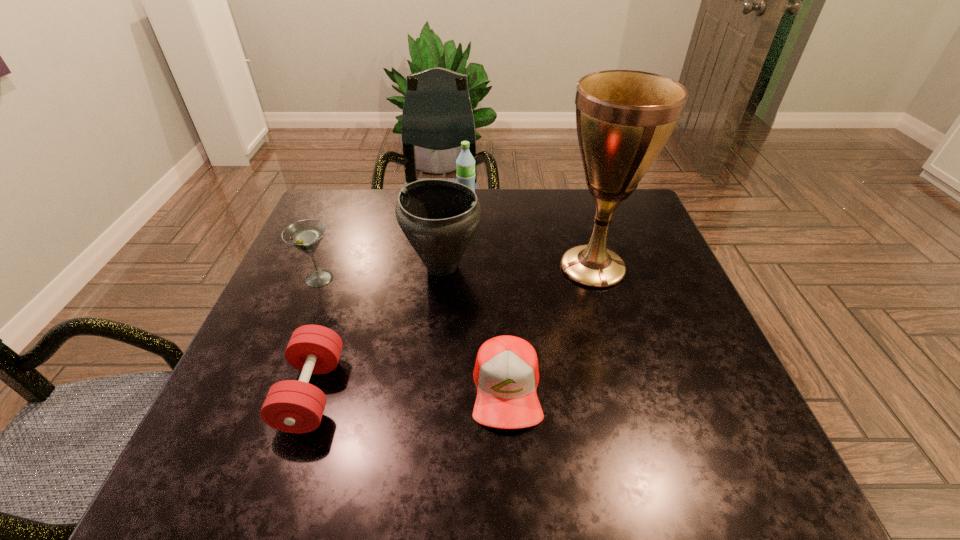
The height and width of the screenshot is (540, 960). I want to click on vacant space located 0.110m on the front of the third shortest object, so click(300, 329).

You are a GUI agent. You are given a task and a screenshot of the screen. Output one action in this format:
    pyautogui.click(x=<x>, y=<y>)
    Task: Click on the vacant space located on the back of the dumbbell
    This screenshot has height=540, width=960.
    Given the screenshot: What is the action you would take?
    pyautogui.click(x=348, y=281)

Find the location of a particular element. Image resolution: width=960 pixels, height=540 pixels. free location located 0.070m on the front-facing side of the shortest object is located at coordinates (511, 473).

You are a GUI agent. You are given a task and a screenshot of the screen. Output one action in this format:
    pyautogui.click(x=<x>, y=<y>)
    Task: Click on the object situated at the far edge
    The width and height of the screenshot is (960, 540).
    Given the screenshot: What is the action you would take?
    pyautogui.click(x=465, y=163)

The width and height of the screenshot is (960, 540). In order to click on object positioned at the near edge in this screenshot , I will do `click(291, 406)`.

Identify the location of martini that is at the left edge. (305, 235).

You are a GUI agent. You are given a task and a screenshot of the screen. Output one action in this format:
    pyautogui.click(x=<x>, y=<y>)
    Task: Click on the dumbbell at the left edge
    The image size is (960, 540).
    Given the screenshot: What is the action you would take?
    pyautogui.click(x=291, y=406)

Where is `object positioned at the right edge`? The image size is (960, 540). object positioned at the right edge is located at coordinates (624, 118).

Image resolution: width=960 pixels, height=540 pixels. I want to click on object present at the near left corner, so click(291, 406).

Where is `blank space at the far edge of the desktop`? The image size is (960, 540). blank space at the far edge of the desktop is located at coordinates (377, 198).